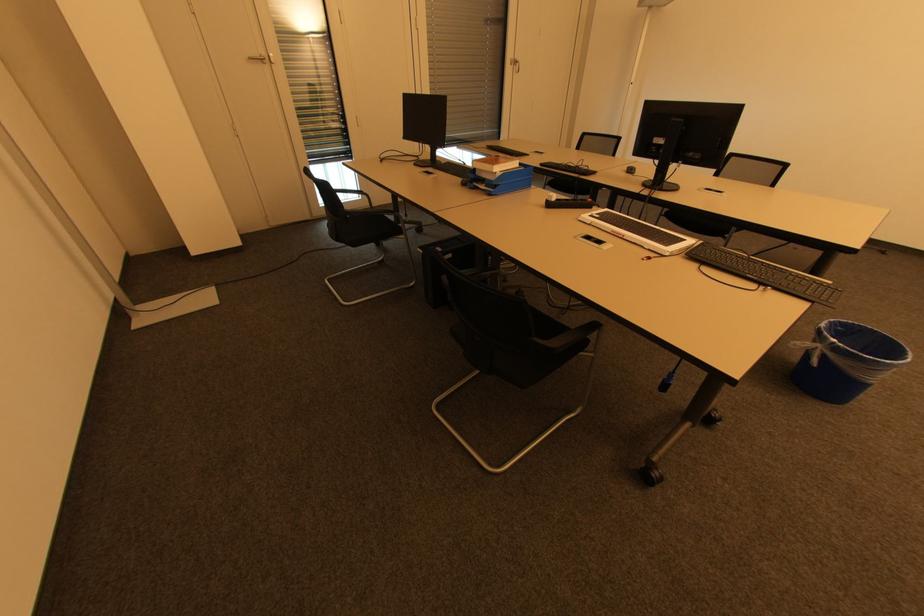
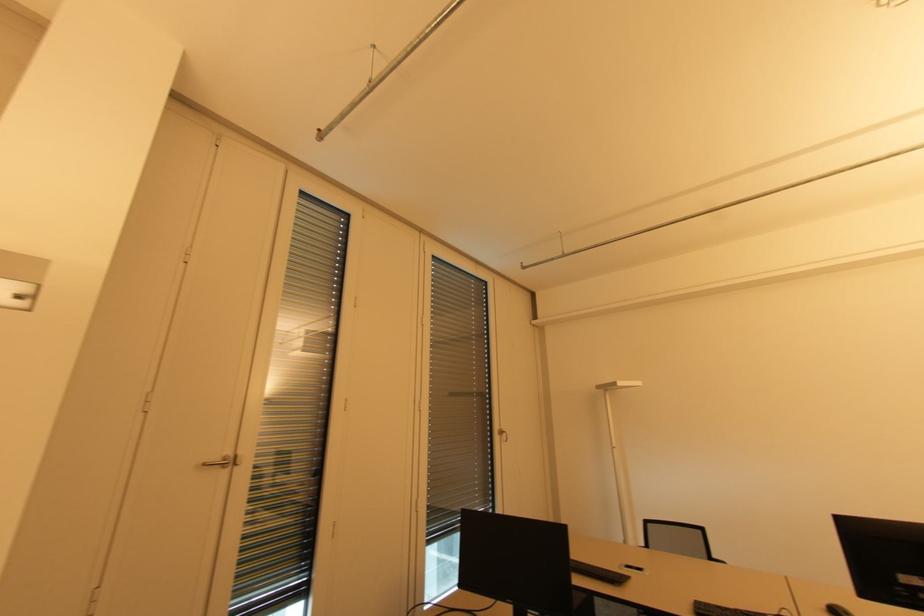
Locate, in the second image, the point that corresponds to pixel 251 60 in the first image.

(207, 464)